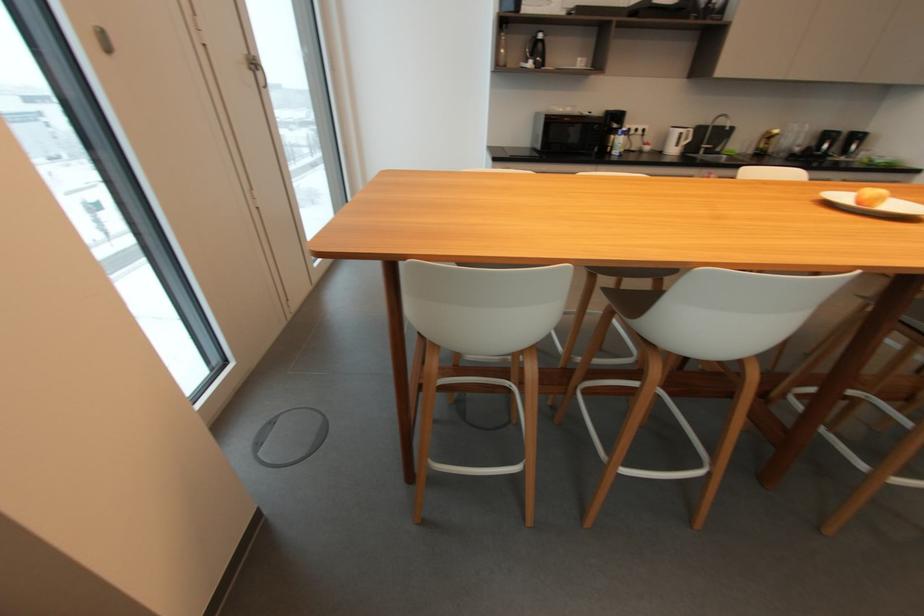
Where would you lift the black water bottle? Please return your answer as a coordinate pair (x, y).

(537, 50)